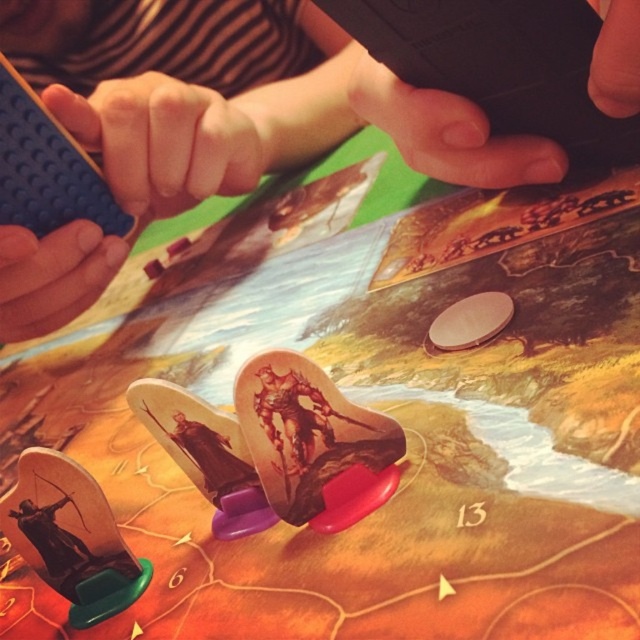
Can you confirm if blue plastic lego brick at upper left is positioned below black matte phone at upper center?

Incorrect, blue plastic lego brick at upper left is not positioned below black matte phone at upper center.

Is blue plastic lego brick at upper left bigger than black matte phone at upper center?

Correct, blue plastic lego brick at upper left is larger in size than black matte phone at upper center.

The image size is (640, 640). I want to click on blue plastic lego brick at upper left, so click(x=164, y=122).